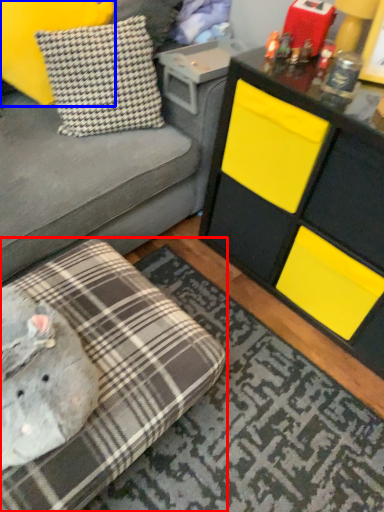
Question: Which object appears farthest to the camera in this image, studio couch (highlighted by a red box) or pillow (highlighted by a blue box)?

Choices:
 (A) studio couch
 (B) pillow

Answer: (B)